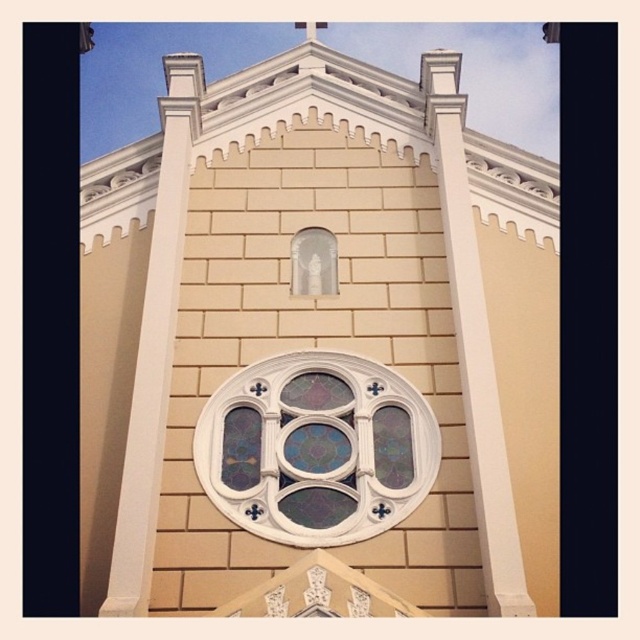
Question: Among these points, which one is nearest to the camera?

Choices:
 (A) (330, 292)
 (B) (285, 410)

Answer: (B)

Question: Which object is farther from the camera taking this photo?

Choices:
 (A) stained glass window at center
 (B) translucent glass statue at center

Answer: (B)

Question: Which point is farther to the camera?

Choices:
 (A) translucent glass statue at center
 (B) stained glass window at center
 (C) white stone cross at upper center
 (D) beige stone church at center

Answer: (C)

Question: Considering the relative positions of stained glass window at center and white stone cross at upper center in the image provided, where is stained glass window at center located with respect to white stone cross at upper center?

Choices:
 (A) left
 (B) right

Answer: (B)

Question: Where is beige stone church at center located in relation to translucent glass statue at center in the image?

Choices:
 (A) left
 (B) right

Answer: (B)

Question: Can you confirm if beige stone church at center is positioned to the left of translucent glass statue at center?

Choices:
 (A) no
 (B) yes

Answer: (A)